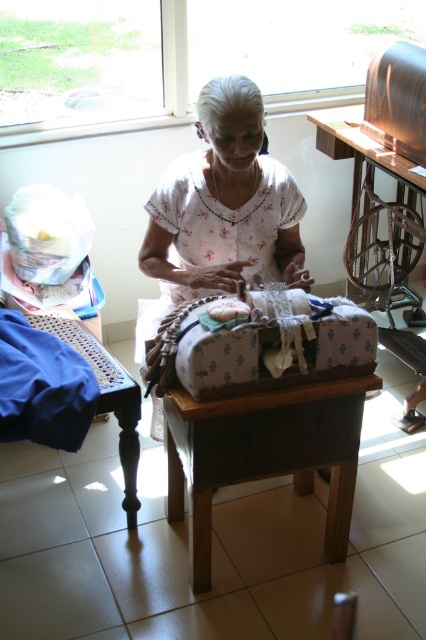
Can you confirm if white floral shirt at center is positioned to the left of wooden chair at center?

Indeed, white floral shirt at center is positioned on the left side of wooden chair at center.

Describe the element at coordinates (224, 204) in the screenshot. I see `white floral shirt at center` at that location.

I want to click on white floral shirt at center, so click(224, 204).

Does brown wooden table at center have a greater height compared to blue fabric at lower left?

Correct, brown wooden table at center is much taller as blue fabric at lower left.

Locate an element on the screen. This screenshot has width=426, height=640. brown wooden table at center is located at coordinates 264,452.

Can you confirm if white floral shirt at center is positioned below blue fabric at lower left?

No, white floral shirt at center is not below blue fabric at lower left.

Consider the image. Can you confirm if white floral shirt at center is positioned to the right of blue fabric at lower left?

Correct, you'll find white floral shirt at center to the right of blue fabric at lower left.

Is point (256, 248) more distant than point (31, 346)?

That is True.

What are the coordinates of `white floral shirt at center` in the screenshot? It's located at pos(224,204).